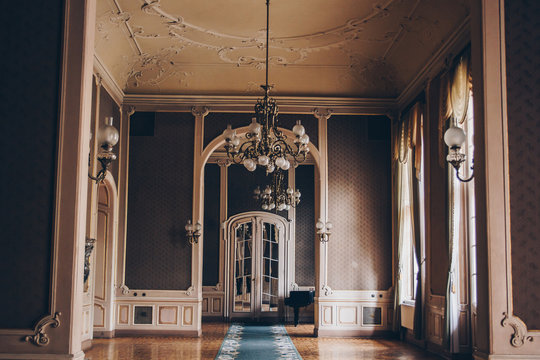
Find the location of a particular element. The width and height of the screenshot is (540, 360). heart shape in ceiling is located at coordinates (229, 59).